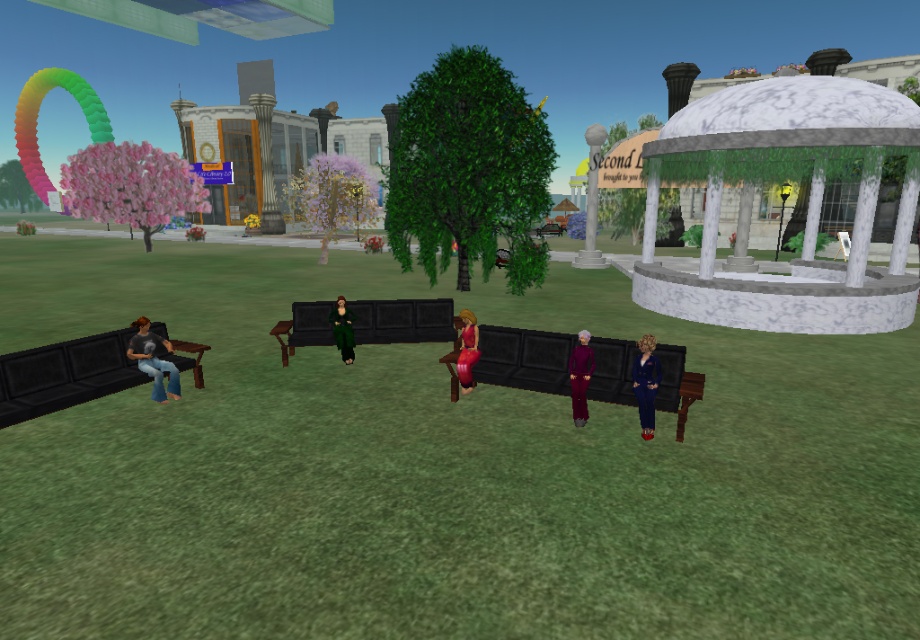
Can you confirm if black leather bench at center is positioned above matte black shirt at left?

Yes.

Is black leather bench at center below matte black shirt at left?

No.

This screenshot has width=920, height=640. I want to click on black leather bench at center, so click(x=524, y=358).

Where is `black leather bench at center`? The height and width of the screenshot is (640, 920). black leather bench at center is located at coordinates (524, 358).

Which is above, shiny black bench at center or purple velvet dress at center?

Positioned higher is shiny black bench at center.

What are the coordinates of `shiny black bench at center` in the screenshot? It's located at (401, 321).

Does matte black bench at left have a greater width compared to shiny red dress at center?

Indeed, matte black bench at left has a greater width compared to shiny red dress at center.

Can you confirm if matte black bench at left is smaller than shiny red dress at center?

No, matte black bench at left is not smaller than shiny red dress at center.

Between point (37, 394) and point (466, 321), which one is positioned in front?

Point (37, 394) is in front.

Identify the location of matte black bench at left. The width and height of the screenshot is (920, 640). (64, 374).